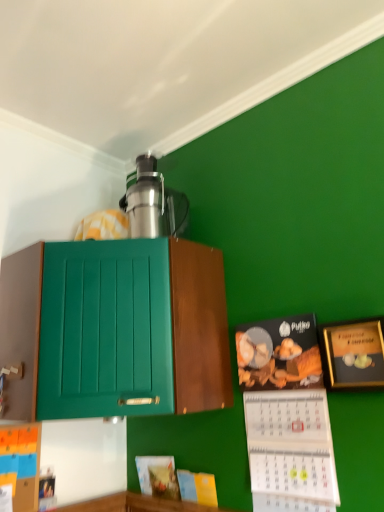
Question: Is satin silver thermos at upper center at the left side of green matte cabinet at upper left?

Choices:
 (A) no
 (B) yes

Answer: (A)

Question: Is green matte cabinet at upper left inside satin silver thermos at upper center?

Choices:
 (A) yes
 (B) no

Answer: (B)

Question: Does satin silver thermos at upper center have a greater height compared to green matte cabinet at upper left?

Choices:
 (A) yes
 (B) no

Answer: (B)

Question: Is satin silver thermos at upper center further to the viewer compared to green matte cabinet at upper left?

Choices:
 (A) yes
 (B) no

Answer: (A)

Question: From the image's perspective, would you say satin silver thermos at upper center is shown under green matte cabinet at upper left?

Choices:
 (A) no
 (B) yes

Answer: (A)

Question: Is point (322, 494) closer or farther from the camera than point (172, 221)?

Choices:
 (A) farther
 (B) closer

Answer: (B)

Question: Would you say matte black calendar at lower right, which ranks as the 1th book in right-to-left order, is inside or outside satin silver thermos at upper center?

Choices:
 (A) inside
 (B) outside

Answer: (B)

Question: Considering the positions of matte black calendar at lower right, which is the fourth book in left-to-right order, and satin silver thermos at upper center in the image, is matte black calendar at lower right, which is the fourth book in left-to-right order, wider or thinner than satin silver thermos at upper center?

Choices:
 (A) thin
 (B) wide

Answer: (A)

Question: Based on their sizes in the image, would you say matte black calendar at lower right, which ranks as the 1th book in right-to-left order, is bigger or smaller than satin silver thermos at upper center?

Choices:
 (A) small
 (B) big

Answer: (B)

Question: Considering their positions, is matte yellow book at lower center, the 3th book viewed from the left, located in front of or behind matte paper book at lower center, which ranks as the third book in right-to-left order?

Choices:
 (A) behind
 (B) front

Answer: (B)

Question: Based on their positions, is matte yellow book at lower center, the 3th book viewed from the left, located to the left or right of matte paper book at lower center, which ranks as the third book in right-to-left order?

Choices:
 (A) left
 (B) right

Answer: (B)

Question: Considering the positions of matte yellow book at lower center, the 3th book viewed from the left, and matte paper book at lower center, arranged as the 2th book when viewed from the left, in the image, is matte yellow book at lower center, the 3th book viewed from the left, wider or thinner than matte paper book at lower center, arranged as the 2th book when viewed from the left,?

Choices:
 (A) wide
 (B) thin

Answer: (B)

Question: Is matte yellow book at lower center, the 2th book when ordered from right to left, taller or shorter than matte paper book at lower center, arranged as the 2th book when viewed from the left?

Choices:
 (A) short
 (B) tall

Answer: (A)

Question: Considering the positions of satin silver thermos at upper center and green matte cabinet at upper left in the image, is satin silver thermos at upper center bigger or smaller than green matte cabinet at upper left?

Choices:
 (A) small
 (B) big

Answer: (A)

Question: From a real-world perspective, is satin silver thermos at upper center positioned above or below green matte cabinet at upper left?

Choices:
 (A) below
 (B) above

Answer: (B)